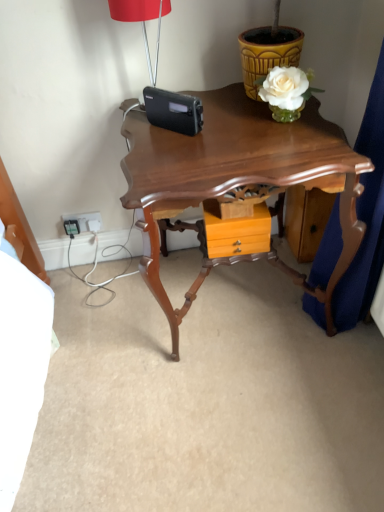
At what (x,y) coordinates should I click in order to perform the action: click on free space in front of matte red lampshade at upper center. Please return your answer as a coordinate pair (x, y). This screenshot has height=512, width=384. Looking at the image, I should click on (158, 134).